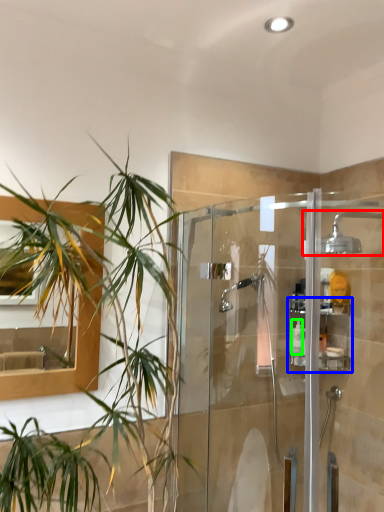
Question: Which is nearer to the shower (highlighted by a red box)? shelf (highlighted by a blue box) or toiletry (highlighted by a green box).

Choices:
 (A) shelf
 (B) toiletry

Answer: (A)